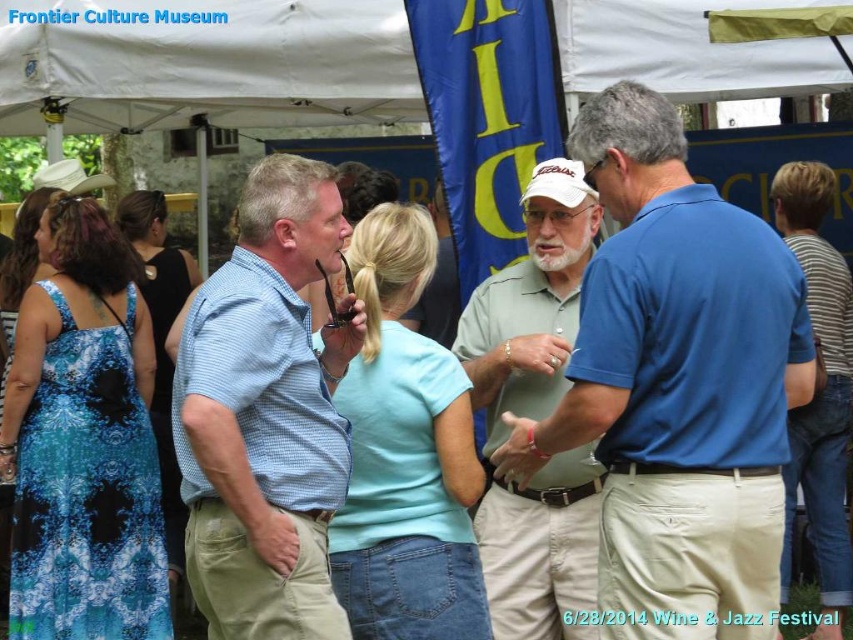
You are at the Wine and Jazz Festival and want to take a photo of the light green polo shirt at center and the blue denim jeans at right. Which one should you focus on first to ensure both are in the frame?

You should focus on the light green polo shirt at center first because it is in front of the blue denim jeans at right, ensuring both will be captured in the frame.

You are an event photographer at the Wine and Jazz Festival. You need to capture a photo of both the light green polo shirt at center and the blue denim jeans at right. Which object should you focus on first if you want to ensure both are in frame without moving the camera?

You should focus on the light green polo shirt at center first because its width surpasses that of the blue denim jeans at right, ensuring it fits within the frame when centered.